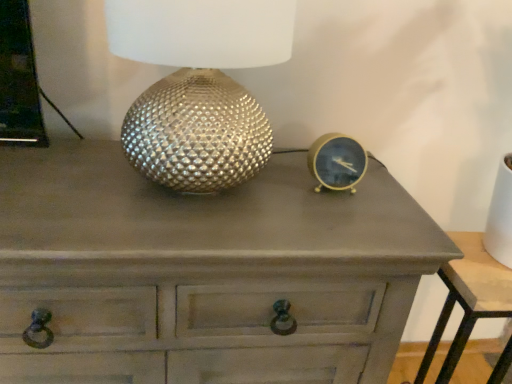
Identify the location of free space above matte gray chest of drawers at center (from a real-world perspective). The image size is (512, 384). (143, 195).